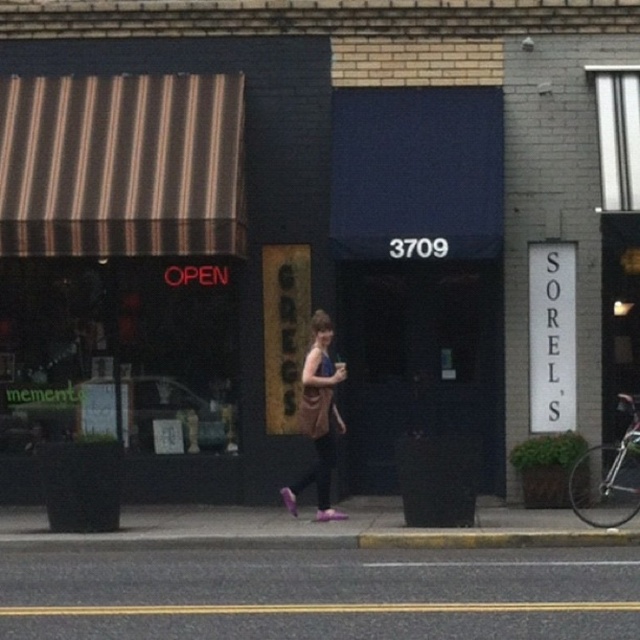
Can you confirm if matte brown purse at center is shorter than yellow concrete curb at lower center?

Incorrect, matte brown purse at center's height does not fall short of yellow concrete curb at lower center's.

Can you confirm if matte brown purse at center is positioned below yellow concrete curb at lower center?

Incorrect, matte brown purse at center is not positioned below yellow concrete curb at lower center.

Does point (298, 484) come farther from viewer compared to point (580, 532)?

Yes, it is behind point (580, 532).

Locate an element on the screen. The image size is (640, 640). matte brown purse at center is located at coordinates (317, 419).

Locate an element on the screen. This screenshot has width=640, height=640. black asphalt road at lower center is located at coordinates (321, 595).

Measure the distance from black asphalt road at lower center to yellow concrete curb at lower center.

1.00 meters

You are a GUI agent. You are given a task and a screenshot of the screen. Output one action in this format:
    pyautogui.click(x=<x>, y=<y>)
    Task: Click on the black asphalt road at lower center
    The image size is (640, 640).
    Given the screenshot: What is the action you would take?
    pyautogui.click(x=321, y=595)

Can you confirm if black asphalt road at lower center is positioned to the right of matte brown purse at center?

Incorrect, black asphalt road at lower center is not on the right side of matte brown purse at center.

Which is in front, point (109, 605) or point (330, 456)?

Point (109, 605)

What do you see at coordinates (321, 595) in the screenshot? I see `black asphalt road at lower center` at bounding box center [321, 595].

At what (x,y) coordinates should I click in order to perform the action: click on black asphalt road at lower center. Please return your answer as a coordinate pair (x, y). The width and height of the screenshot is (640, 640). Looking at the image, I should click on 321,595.